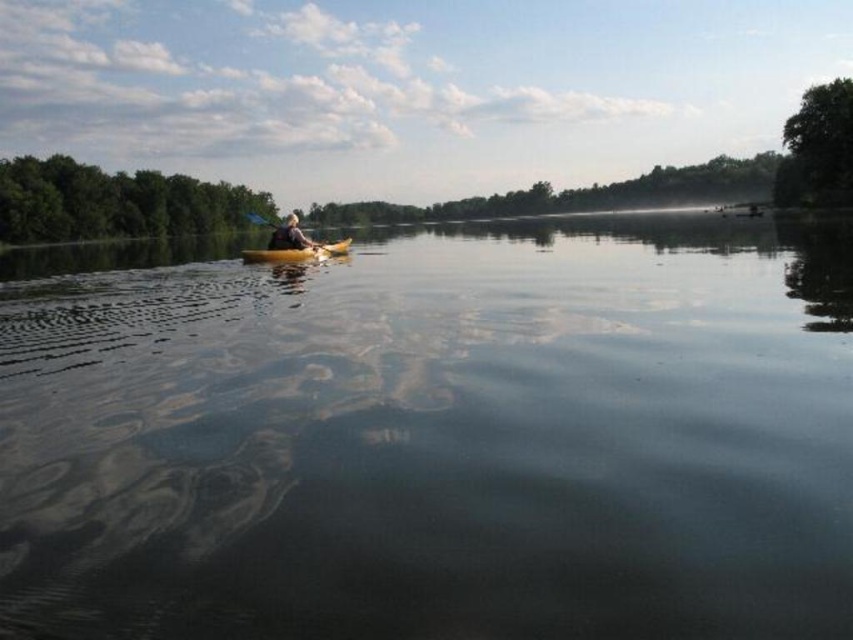
You are standing on the dock and see two yellow vessels in the water. Which one is closer to you, the yellow matte canoe at center or the yellow plastic kayak at center?

The yellow matte canoe at center is closer to you because it is positioned further to the viewer than the yellow plastic kayak at center.

You are a photographer planning to take a photo of the yellow matte canoe at center and the yellow plastic kayak at center from above. Which object will appear taller in the photo?

The yellow matte canoe at center will appear taller in the photo because it is much taller than the yellow plastic kayak at center.